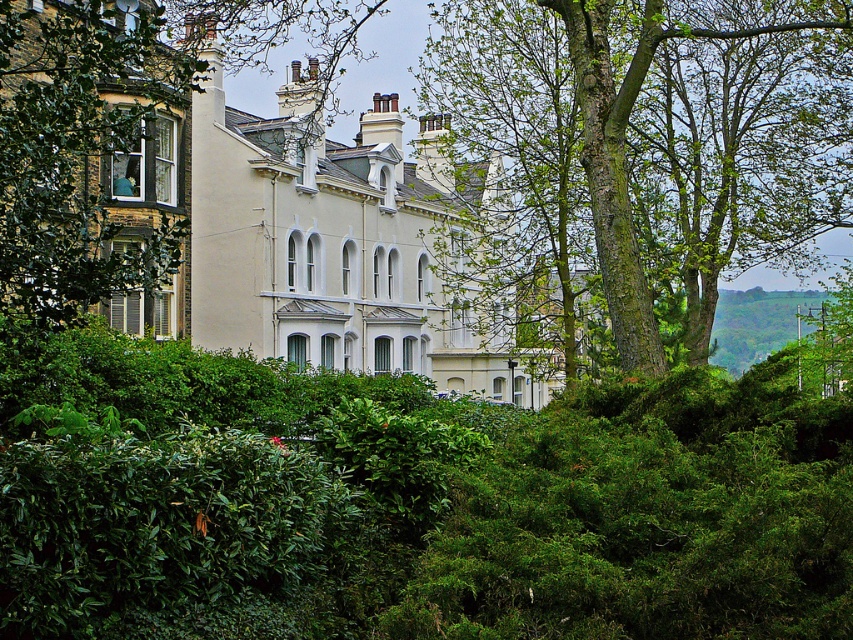
Based on the photo, is green bark tree at center closer to camera compared to beige stone mansion at center?

No, it is behind beige stone mansion at center.

What do you see at coordinates (524, 179) in the screenshot? I see `green bark tree at center` at bounding box center [524, 179].

This screenshot has height=640, width=853. Find the location of `green bark tree at center`. green bark tree at center is located at coordinates (524, 179).